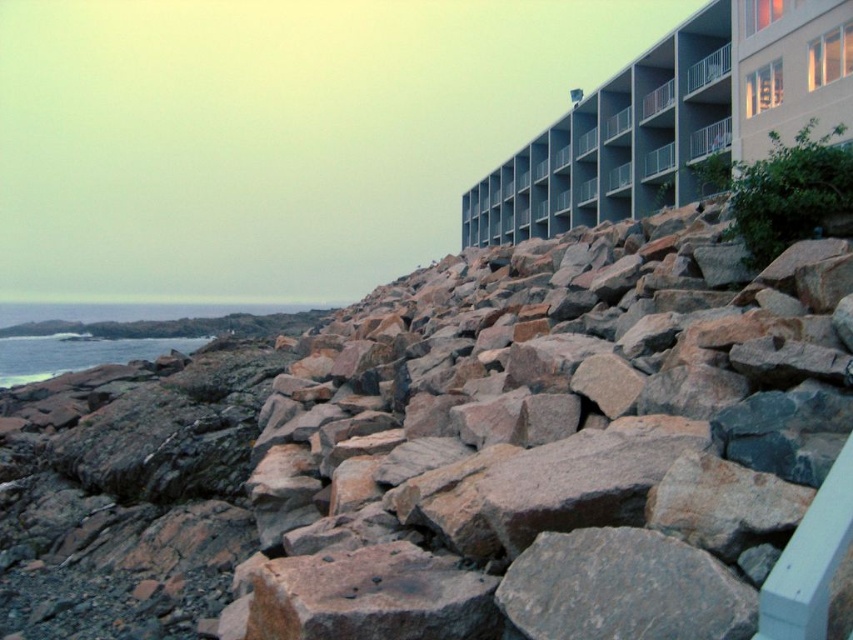
Which of these two, rusty stone boulder at center or smooth blue water at lower left, stands shorter?

smooth blue water at lower left is shorter.

Who is more distant from viewer, (341, 332) or (42, 358)?

Point (42, 358)

In order to click on rusty stone boulder at center in this screenshot , I will do `click(566, 449)`.

Where is `rusty stone boulder at center`? rusty stone boulder at center is located at coordinates (566, 449).

Between point (636, 404) and point (666, 202), which one is positioned in front?

Point (636, 404) is in front.

Which is behind, point (759, 312) or point (642, 81)?

The point (642, 81) is behind.

At what (x,y) coordinates should I click in order to perform the action: click on rusty stone boulder at center. Please return your answer as a coordinate pair (x, y). Looking at the image, I should click on (566, 449).

Is point (636, 108) farther from camera compared to point (39, 340)?

No, (636, 108) is closer to viewer.

Locate an element on the screen. This screenshot has height=640, width=853. beige concrete building at upper right is located at coordinates (674, 118).